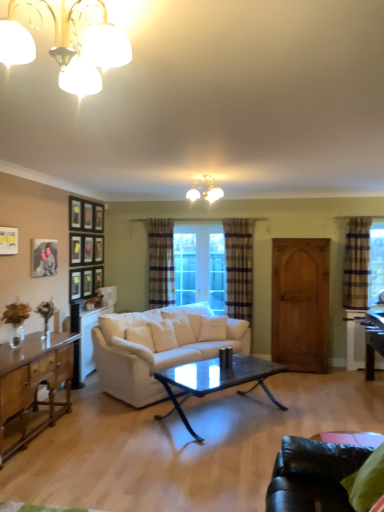
Question: Is matte white chandelier at upper center, placed as the 2th lamp when sorted from front to back, surrounded by plaid fabric curtain at center, which is counted as the second curtain, starting from the front?

Choices:
 (A) yes
 (B) no

Answer: (B)

Question: Is plaid fabric curtain at center, which is counted as the second curtain, starting from the front, oriented towards matte white chandelier at upper center, placed as the 2th lamp when sorted from front to back?

Choices:
 (A) no
 (B) yes

Answer: (B)

Question: Is plaid fabric curtain at center, placed as the second curtain when sorted from back to front, to the right of matte white chandelier at upper center, placed as the 2th lamp when sorted from front to back, from the viewer's perspective?

Choices:
 (A) no
 (B) yes

Answer: (B)

Question: Does plaid fabric curtain at center, placed as the second curtain when sorted from back to front, have a greater height compared to matte white chandelier at upper center, the first lamp viewed from the right?

Choices:
 (A) no
 (B) yes

Answer: (B)

Question: Is the depth of plaid fabric curtain at center, marked as the second curtain in a right-to-left arrangement, less than that of matte white chandelier at upper center, positioned as the second lamp in left-to-right order?

Choices:
 (A) no
 (B) yes

Answer: (A)

Question: Would you say matte black picture frame at upper left, the 4th picture frame positioned from the right, is to the left or to the right of plaid fabric curtain at center, which is counted as the second curtain, starting from the front, in the picture?

Choices:
 (A) left
 (B) right

Answer: (A)

Question: From the image's perspective, is matte black picture frame at upper left, the 1th picture frame from the front, located above or below plaid fabric curtain at center, which is counted as the second curtain, starting from the front?

Choices:
 (A) below
 (B) above

Answer: (B)

Question: From a real-world perspective, is matte black picture frame at upper left, the 1th picture frame from the front, physically located above or below plaid fabric curtain at center, marked as the second curtain in a right-to-left arrangement?

Choices:
 (A) above
 (B) below

Answer: (A)

Question: From their relative heights in the image, would you say matte black picture frame at upper left, which appears as the 4th picture frame when viewed from the back, is taller or shorter than plaid fabric curtain at center, marked as the second curtain in a right-to-left arrangement?

Choices:
 (A) tall
 (B) short

Answer: (B)

Question: Would you say wooden armoire at right is inside or outside matte black picture frame at upper left, which is the 3th picture frame in left-to-right order?

Choices:
 (A) outside
 (B) inside

Answer: (A)

Question: Looking at their shapes, would you say wooden armoire at right is wider or thinner than matte black picture frame at upper left, which is the 3th picture frame in left-to-right order?

Choices:
 (A) wide
 (B) thin

Answer: (A)

Question: In the image, is wooden armoire at right positioned in front of or behind matte black picture frame at upper left, arranged as the first picture frame when viewed from the back?

Choices:
 (A) front
 (B) behind

Answer: (B)

Question: Does point (284, 348) appear closer or farther from the camera than point (79, 254)?

Choices:
 (A) farther
 (B) closer

Answer: (A)

Question: From the image's perspective, is plaid fabric curtain at center, marked as the second curtain in a right-to-left arrangement, positioned above or below plaid fabric curtain at center, arranged as the 3th curtain when viewed from the right?

Choices:
 (A) below
 (B) above

Answer: (A)

Question: From their relative heights in the image, would you say plaid fabric curtain at center, marked as the second curtain in a right-to-left arrangement, is taller or shorter than plaid fabric curtain at center, which is the first curtain in back-to-front order?

Choices:
 (A) short
 (B) tall

Answer: (B)